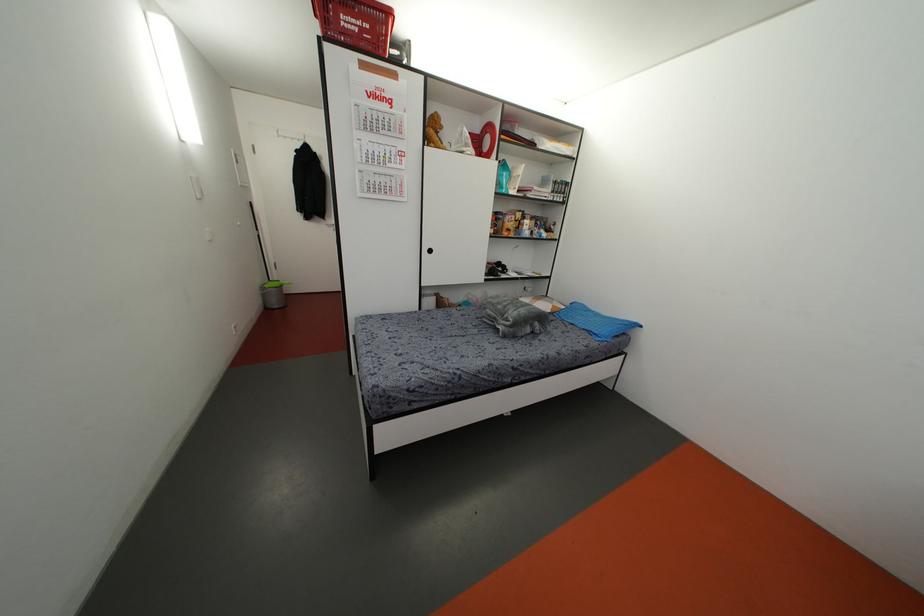
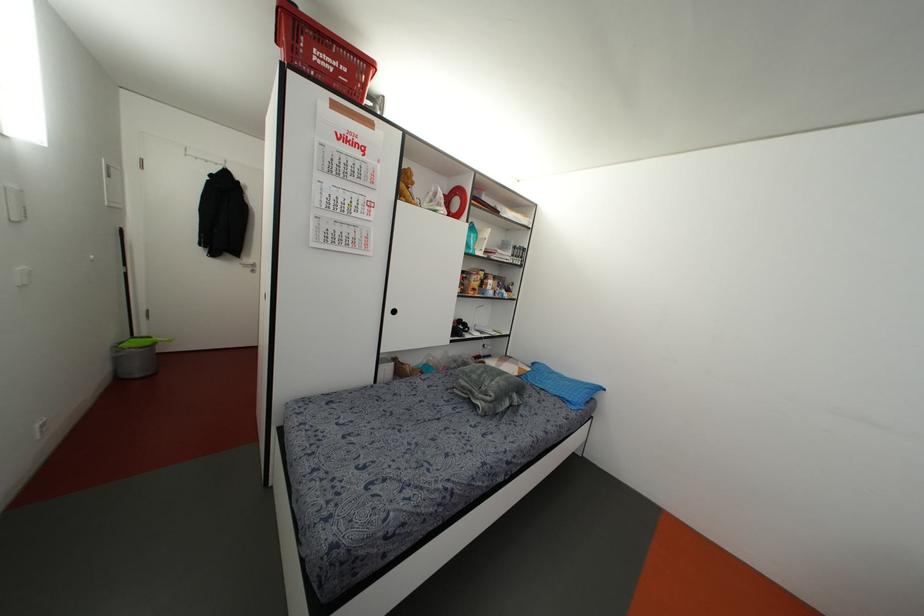
Where in the second image is the point corresponding to (x=596, y=331) from the first image?

(569, 399)